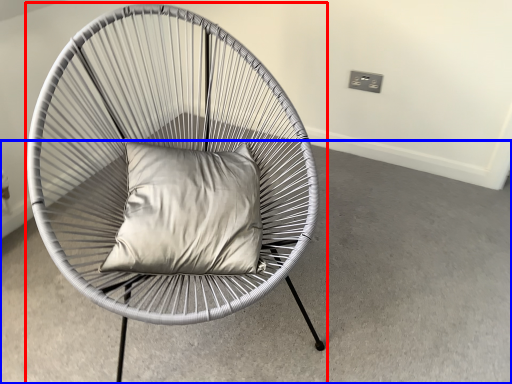
Question: Which object is further to the camera taking this photo, chair (highlighted by a red box) or concrete (highlighted by a blue box)?

Choices:
 (A) chair
 (B) concrete

Answer: (B)